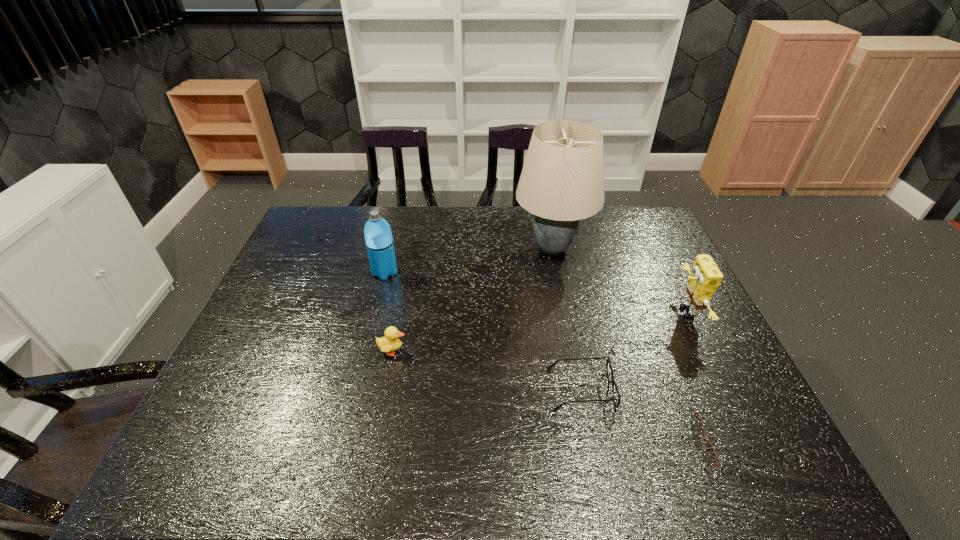
You are a GUI agent. You are given a task and a screenshot of the screen. Output one action in this format:
    pyautogui.click(x=<x>, y=<y>)
    Task: Click on the vacant space situated 0.380m on the left of the lampshade
    
    Given the screenshot: What is the action you would take?
    pyautogui.click(x=399, y=248)

This screenshot has width=960, height=540. I want to click on blank area located on the back of the fifth shortest object, so click(394, 237).

This screenshot has width=960, height=540. What are the coordinates of `free space located on the face of the sponge` in the screenshot? It's located at (564, 312).

Where is `free location located on the face of the sponge`? The width and height of the screenshot is (960, 540). free location located on the face of the sponge is located at coordinates (621, 312).

Where is `vacant space situated on the face of the sponge`? The image size is (960, 540). vacant space situated on the face of the sponge is located at coordinates (562, 312).

Locate an element on the screen. The image size is (960, 540). free space located on the front-facing side of the duckling is located at coordinates (445, 351).

You are a GUI agent. You are given a task and a screenshot of the screen. Output one action in this format:
    pyautogui.click(x=<x>, y=<y>)
    Task: Click on the vacant region located with the lenses facing outward on the fifth tallest object
    Image resolution: width=960 pixels, height=540 pixels.
    Given the screenshot: What is the action you would take?
    pyautogui.click(x=387, y=389)

Identify the location of vacant position located with the lenses facing outward on the fifth tallest object. (453, 389).

Find the location of a particular element. free spot located 0.400m with the lenses facing outward on the fifth tallest object is located at coordinates (382, 389).

Find the location of a particular element. This screenshot has height=540, width=960. vacant space located 0.130m on the face of the nearest object is located at coordinates (642, 442).